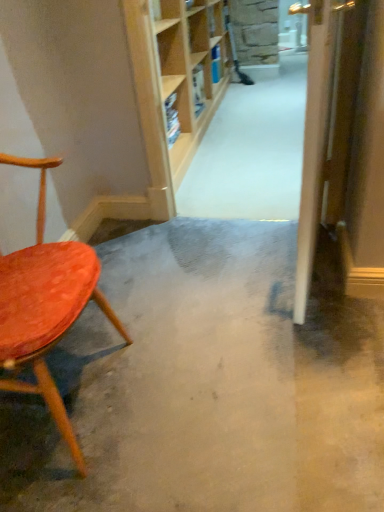
Question: Does velvet orange chair at left appear on the right side of smooth concrete floor at center?

Choices:
 (A) no
 (B) yes

Answer: (A)

Question: Is velvet orange chair at left wider than smooth concrete floor at center?

Choices:
 (A) no
 (B) yes

Answer: (A)

Question: Is velvet orange chair at left aimed at smooth concrete floor at center?

Choices:
 (A) yes
 (B) no

Answer: (B)

Question: From a real-world perspective, does velvet orange chair at left stand above smooth concrete floor at center?

Choices:
 (A) yes
 (B) no

Answer: (A)

Question: Is velvet orange chair at left further to the viewer compared to smooth concrete floor at center?

Choices:
 (A) yes
 (B) no

Answer: (B)

Question: Is point (241, 357) positioned closer to the camera than point (311, 250)?

Choices:
 (A) closer
 (B) farther

Answer: (B)

Question: Is smooth concrete floor at center taller or shorter than wooden door at right?

Choices:
 (A) short
 (B) tall

Answer: (A)

Question: Is smooth concrete floor at center bigger or smaller than wooden door at right?

Choices:
 (A) big
 (B) small

Answer: (A)

Question: Relative to wooden door at right, is smooth concrete floor at center in front or behind?

Choices:
 (A) behind
 (B) front

Answer: (B)

Question: Is wooden door at right wider or thinner than velvet orange chair at left?

Choices:
 (A) wide
 (B) thin

Answer: (B)

Question: Is wooden door at right taller or shorter than velvet orange chair at left?

Choices:
 (A) short
 (B) tall

Answer: (B)

Question: Do you think wooden door at right is within velvet orange chair at left, or outside of it?

Choices:
 (A) inside
 (B) outside

Answer: (B)

Question: In terms of size, does wooden door at right appear bigger or smaller than velvet orange chair at left?

Choices:
 (A) small
 (B) big

Answer: (A)

Question: From a real-world perspective, is wooden door at right positioned above or below smooth concrete floor at center?

Choices:
 (A) below
 (B) above

Answer: (B)

Question: Considering the positions of wooden door at right and smooth concrete floor at center in the image, is wooden door at right taller or shorter than smooth concrete floor at center?

Choices:
 (A) tall
 (B) short

Answer: (A)